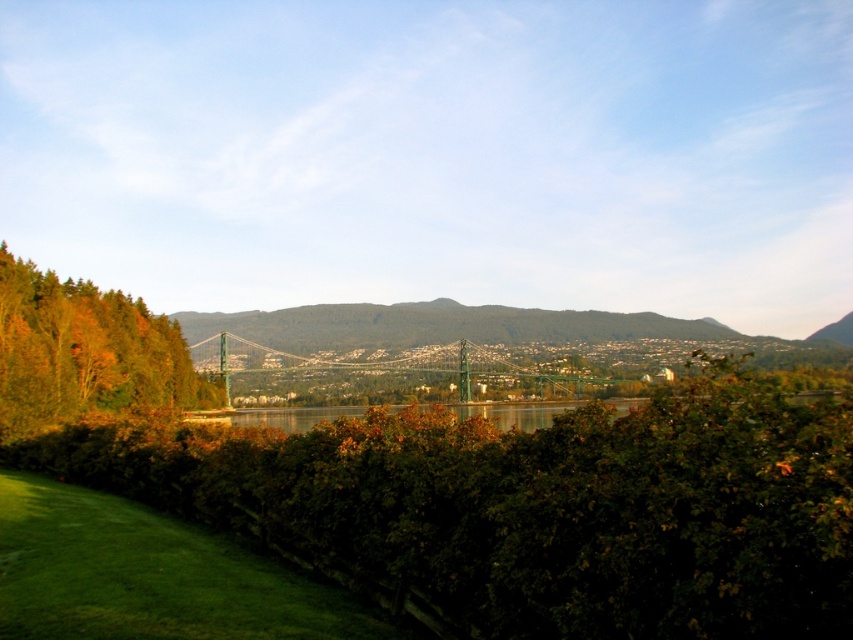
You are standing on the grassy field in the foreground and want to see the green leafy hedge at center and the greenish reflective water at center. Which one appears taller from your perspective?

The green leafy hedge at center is not as tall as the greenish reflective water at center, so the greenish reflective water at center appears taller from your perspective.

You are standing at the edge of the grassy field in the foreground, looking towards the center of the image. Which object, the green leafy hedge at center or the green metallic bridge at center, is taller?

The green leafy hedge at center has a lesser height compared to the green metallic bridge at center, so the green metallic bridge at center is taller.